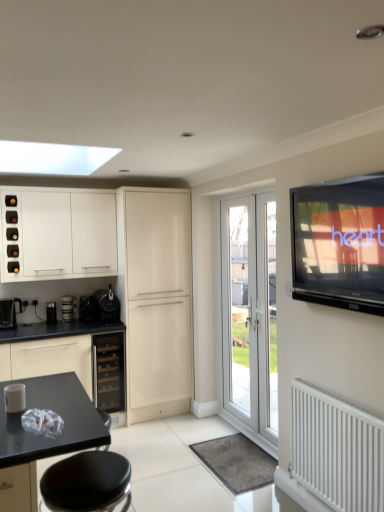
Question: Does white glossy cabinet at upper left, placed as the 1th cabinetry when sorted from left to right, have a greater height compared to metallic silver cup at left, placed as the third appliance when sorted from right to left?

Choices:
 (A) yes
 (B) no

Answer: (A)

Question: Can you confirm if white glossy cabinet at upper left, placed as the second cabinetry when sorted from right to left, is wider than metallic silver cup at left, placed as the third appliance when sorted from right to left?

Choices:
 (A) yes
 (B) no

Answer: (A)

Question: From a real-world perspective, does white glossy cabinet at upper left, placed as the second cabinetry when sorted from right to left, sit lower than metallic silver cup at left, placed as the third appliance when sorted from right to left?

Choices:
 (A) no
 (B) yes

Answer: (A)

Question: From the image's perspective, is white glossy cabinet at upper left, placed as the 1th cabinetry when sorted from left to right, on metallic silver cup at left, placed as the third appliance when sorted from right to left?

Choices:
 (A) yes
 (B) no

Answer: (A)

Question: Is there a large distance between white glossy cabinet at upper left, placed as the 1th cabinetry when sorted from left to right, and metallic silver cup at left, placed as the third appliance when sorted from right to left?

Choices:
 (A) yes
 (B) no

Answer: (B)

Question: Is point (114, 374) positioned closer to the camera than point (69, 318)?

Choices:
 (A) closer
 (B) farther

Answer: (A)

Question: Based on their sizes in the image, would you say satin black wine cooler at center is bigger or smaller than metallic silver cup at left, marked as the 2th appliance in a left-to-right arrangement?

Choices:
 (A) big
 (B) small

Answer: (A)

Question: Is satin black wine cooler at center taller or shorter than metallic silver cup at left, placed as the third appliance when sorted from right to left?

Choices:
 (A) short
 (B) tall

Answer: (B)

Question: From the image's perspective, relative to metallic silver cup at left, placed as the third appliance when sorted from right to left, is satin black wine cooler at center above or below?

Choices:
 (A) above
 (B) below

Answer: (B)

Question: From a real-world perspective, relative to glossy cream cabinet at center, placed as the 1th cabinetry when sorted from right to left, is satin black coffee machine at lower center, the 4th appliance from the left, vertically above or below?

Choices:
 (A) below
 (B) above

Answer: (B)

Question: From their relative heights in the image, would you say satin black coffee machine at lower center, positioned as the first appliance in right-to-left order, is taller or shorter than glossy cream cabinet at center, placed as the 1th cabinetry when sorted from right to left?

Choices:
 (A) short
 (B) tall

Answer: (A)

Question: Considering the positions of point (114, 309) and point (157, 292), is point (114, 309) closer or farther from the camera than point (157, 292)?

Choices:
 (A) farther
 (B) closer

Answer: (B)

Question: Relative to glossy cream cabinet at center, which appears as the 2th cabinetry when viewed from the left, is satin black coffee machine at lower center, the 4th appliance from the left, in front or behind?

Choices:
 (A) behind
 (B) front

Answer: (A)

Question: From a real-world perspective, relative to metallic silver cup at left, placed as the third appliance when sorted from right to left, is white glossy cabinet at upper left, placed as the second cabinetry when sorted from right to left, vertically above or below?

Choices:
 (A) below
 (B) above

Answer: (B)

Question: Relative to metallic silver cup at left, marked as the 2th appliance in a left-to-right arrangement, is white glossy cabinet at upper left, placed as the second cabinetry when sorted from right to left, in front or behind?

Choices:
 (A) behind
 (B) front

Answer: (B)